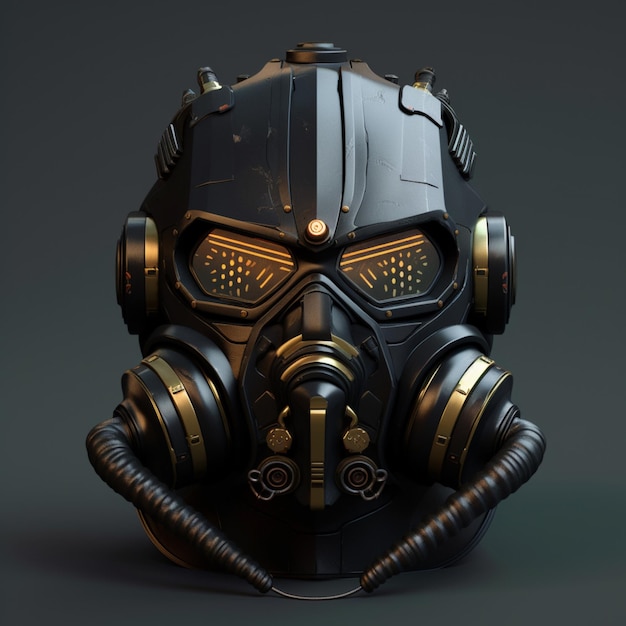
Locate an element on the screen. gold trim is located at coordinates (187, 411), (439, 429), (481, 243), (150, 250), (314, 419), (310, 359), (334, 344), (314, 228).